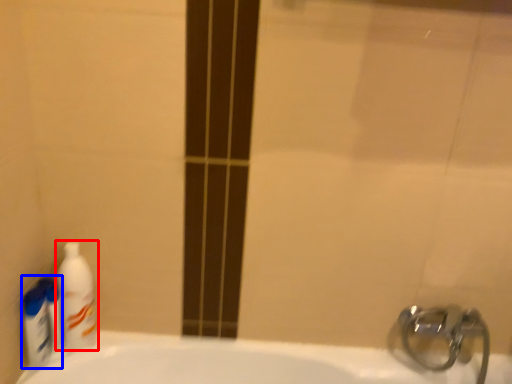
Question: Which object is closer to the camera taking this photo, cleaning product (highlighted by a red box) or cleaning product (highlighted by a blue box)?

Choices:
 (A) cleaning product
 (B) cleaning product

Answer: (B)